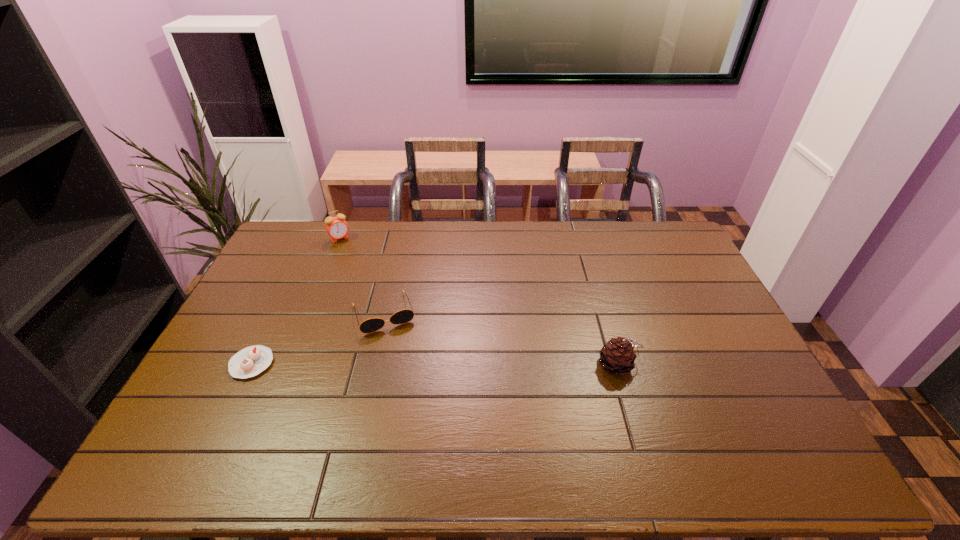
You are a GUI agent. You are given a task and a screenshot of the screen. Output one action in this format:
    pyautogui.click(x=<x>, y=<y>)
    Task: Click on the free spot on the desktop that is between the cupcake and the rightmost object and is positioned on the face of the second object from left to right
    The image size is (960, 540).
    Given the screenshot: What is the action you would take?
    (420, 364)

This screenshot has height=540, width=960. Find the location of `vacant space on the desktop that is between the leftmost object and the pinecone and is positioned on the front-facing side of the second object from right to left`. vacant space on the desktop that is between the leftmost object and the pinecone and is positioned on the front-facing side of the second object from right to left is located at coordinates (400, 364).